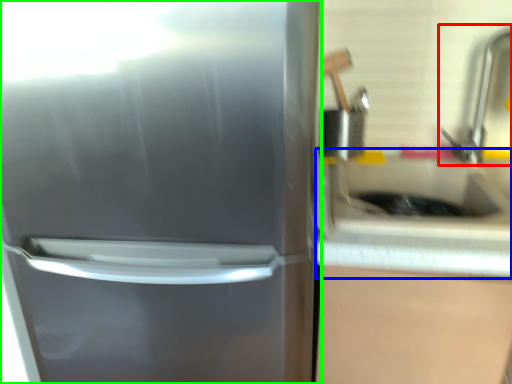
Question: Which is farther away from faucet (highlighted by a red box)? counter top (highlighted by a blue box) or refrigerator (highlighted by a green box)?

Choices:
 (A) counter top
 (B) refrigerator

Answer: (B)